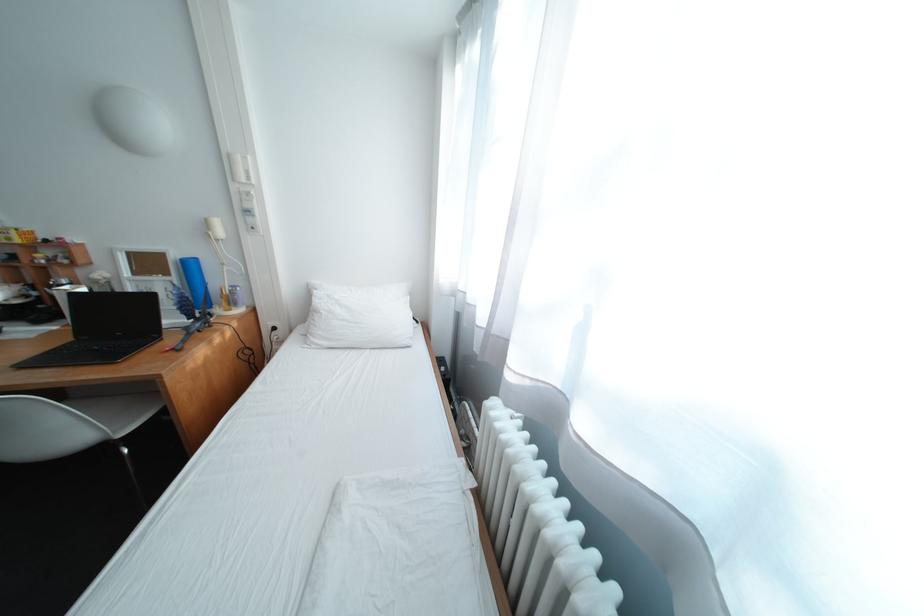
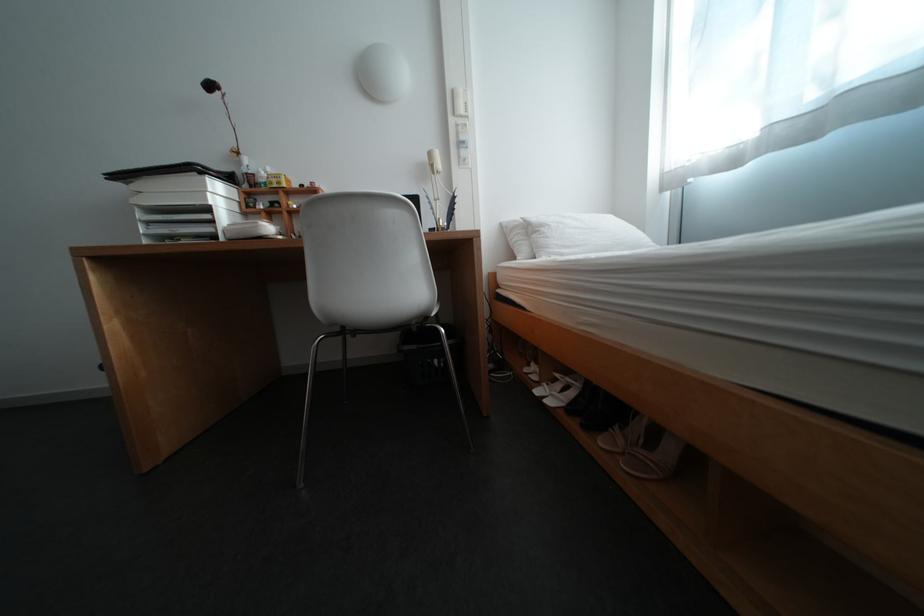
Find the pixel in the second image that matches point 242,156 in the first image.

(466, 92)